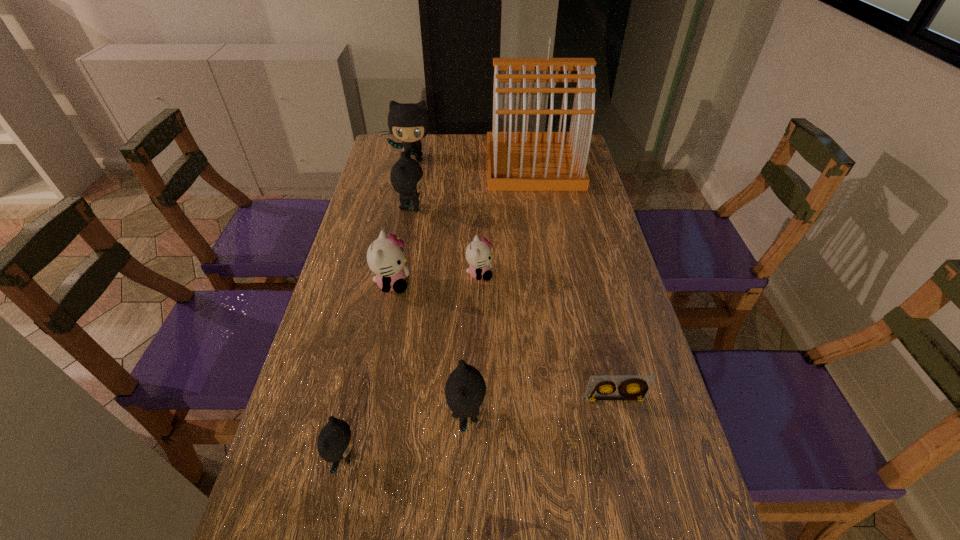
Locate an element on the screen. the shortest object is located at coordinates (632, 387).

Identify the location of videotape. (632, 387).

Identify the location of vacant space located 0.270m with an open door on the birdcage. The height and width of the screenshot is (540, 960). (416, 165).

What are the coordinates of `vacant space located with an open door on the birdcage` in the screenshot? It's located at (428, 165).

In order to click on free space located 0.270m with an open door on the birdcage in this screenshot , I will do `click(416, 165)`.

The width and height of the screenshot is (960, 540). In order to click on blank area located 0.310m on the front-facing side of the farthest kitten in this screenshot , I will do `click(401, 219)`.

The width and height of the screenshot is (960, 540). I want to click on vacant space located on the front-facing side of the third smallest gray kitten, so click(x=506, y=209).

At what (x,y) coordinates should I click in order to perform the action: click on vacant point located on the front-facing side of the bigger white kitten. Please return your answer as a coordinate pair (x, y). This screenshot has height=540, width=960. Looking at the image, I should click on (516, 284).

Where is `free spot located 0.230m on the front-facing side of the rightmost gray kitten`? Image resolution: width=960 pixels, height=540 pixels. free spot located 0.230m on the front-facing side of the rightmost gray kitten is located at coordinates (594, 415).

Identify the location of vacant space located 0.340m on the front-facing side of the right white kitten. This screenshot has width=960, height=540. (614, 274).